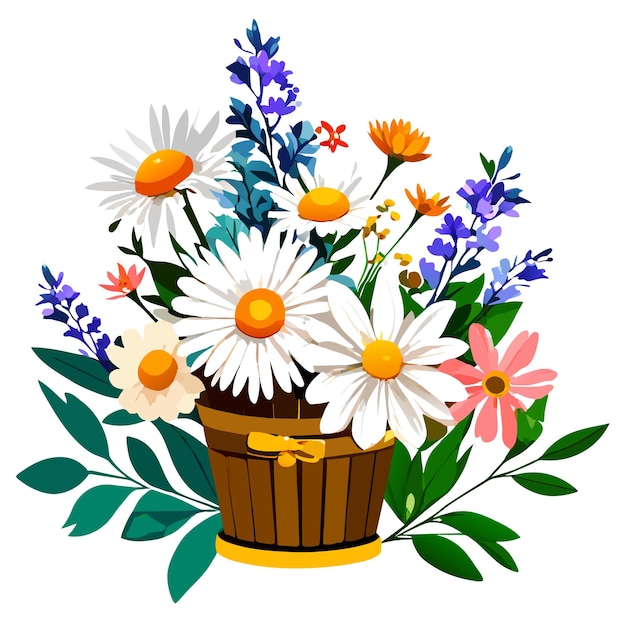
Identify the location of black line on top of yellow base of basket. (305, 546).